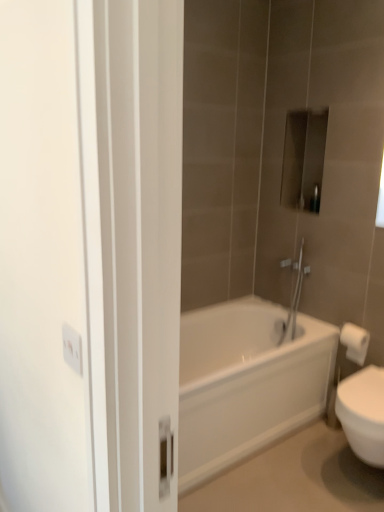
Question: Considering the relative positions of white glossy bathtub at center and white paper towel at right in the image provided, is white glossy bathtub at center to the right of white paper towel at right from the viewer's perspective?

Choices:
 (A) yes
 (B) no

Answer: (B)

Question: From a real-world perspective, is white glossy bathtub at center on top of white paper towel at right?

Choices:
 (A) no
 (B) yes

Answer: (A)

Question: Is white glossy bathtub at center thinner than white paper towel at right?

Choices:
 (A) no
 (B) yes

Answer: (A)

Question: Considering the relative sizes of white glossy bathtub at center and white paper towel at right in the image provided, is white glossy bathtub at center wider than white paper towel at right?

Choices:
 (A) yes
 (B) no

Answer: (A)

Question: Can you confirm if white glossy bathtub at center is shorter than white paper towel at right?

Choices:
 (A) no
 (B) yes

Answer: (A)

Question: From the image's perspective, is white glossy bathtub at center on top of white paper towel at right?

Choices:
 (A) yes
 (B) no

Answer: (B)

Question: From the image's perspective, would you say metallic rectangular object at upper center is positioned over white glossy bathtub at center?

Choices:
 (A) yes
 (B) no

Answer: (A)

Question: Can you confirm if metallic rectangular object at upper center is bigger than white glossy bathtub at center?

Choices:
 (A) no
 (B) yes

Answer: (A)

Question: Does metallic rectangular object at upper center have a lesser height compared to white glossy bathtub at center?

Choices:
 (A) no
 (B) yes

Answer: (B)

Question: Can you confirm if metallic rectangular object at upper center is wider than white glossy bathtub at center?

Choices:
 (A) yes
 (B) no

Answer: (B)

Question: Is metallic rectangular object at upper center beside white glossy bathtub at center?

Choices:
 (A) no
 (B) yes

Answer: (A)

Question: Considering the relative positions of metallic rectangular object at upper center and white glossy bathtub at center in the image provided, is metallic rectangular object at upper center behind white glossy bathtub at center?

Choices:
 (A) no
 (B) yes

Answer: (B)

Question: From the image's perspective, is white paper towel at right on top of metallic rectangular object at upper center?

Choices:
 (A) yes
 (B) no

Answer: (B)